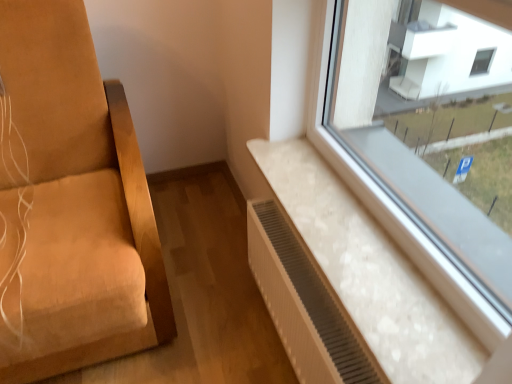
Locate an element on the screen. vacant space situated above white marble radiator at lower right (from a real-world perspective) is located at coordinates (346, 218).